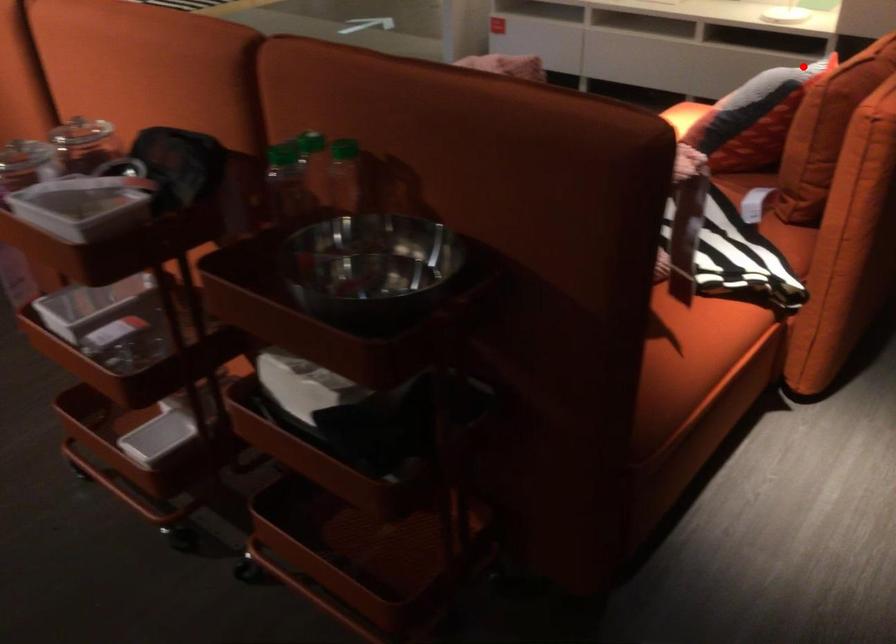
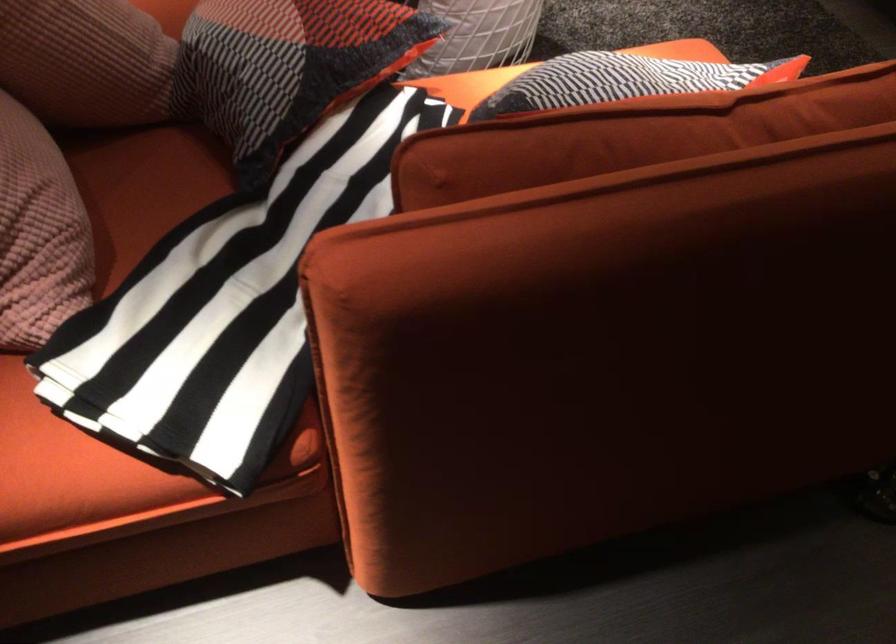
Question: I am providing you with two images of the same scene from different viewpoints. A red point is shown in image1. For the corresponding object point in image2, is it positioned nearer or farther from the camera?

Choices:
 (A) Nearer
 (B) Farther

Answer: (A)